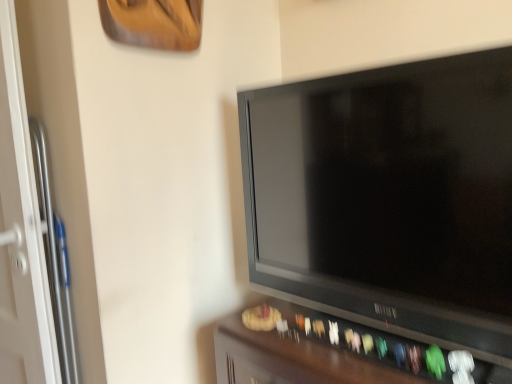
You are a GUI agent. You are given a task and a screenshot of the screen. Output one action in this format:
    pyautogui.click(x=<x>, y=<y>)
    Task: Click on the free space below black glossy tv at center (from a real-world perspective)
    
    Given the screenshot: What is the action you would take?
    pyautogui.click(x=312, y=321)